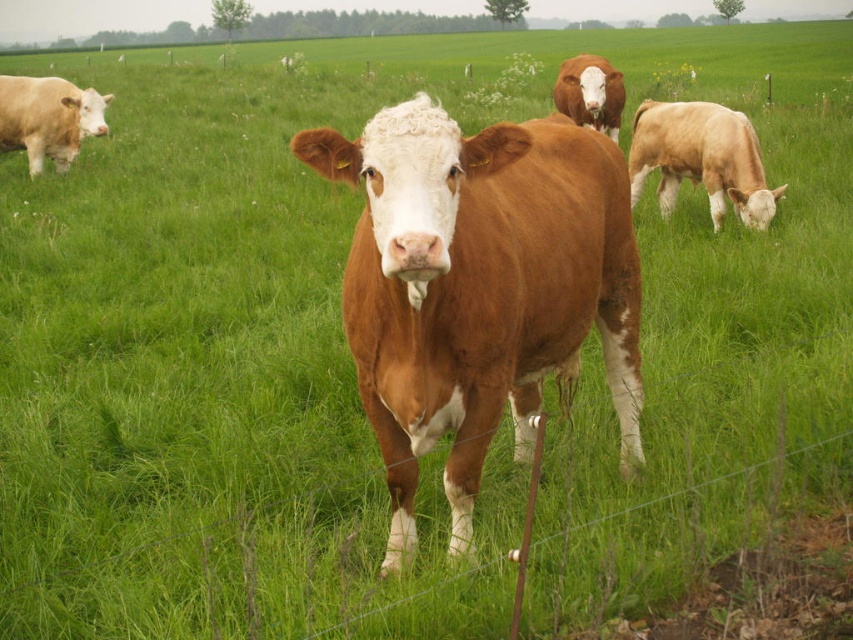
Question: Which point appears farthest from the camera in this image?

Choices:
 (A) (595, 54)
 (B) (604, 308)

Answer: (A)

Question: Can you confirm if brown smooth cow at center is positioned below brown matte cow at upper center?

Choices:
 (A) no
 (B) yes

Answer: (B)

Question: Estimate the real-world distances between objects in this image. Which object is closer to the matte white cow at left?

Choices:
 (A) brown matte cow at upper center
 (B) brown smooth cow at center

Answer: (A)

Question: Based on their relative distances, which object is farther from the brown smooth cow at center?

Choices:
 (A) matte white cow at left
 (B) light brown smooth cow at right
 (C) brown matte cow at upper center

Answer: (A)

Question: Is the position of light brown smooth cow at right less distant than that of brown matte cow at upper center?

Choices:
 (A) yes
 (B) no

Answer: (A)

Question: Does matte white cow at left appear on the right side of brown matte cow at upper center?

Choices:
 (A) no
 (B) yes

Answer: (A)